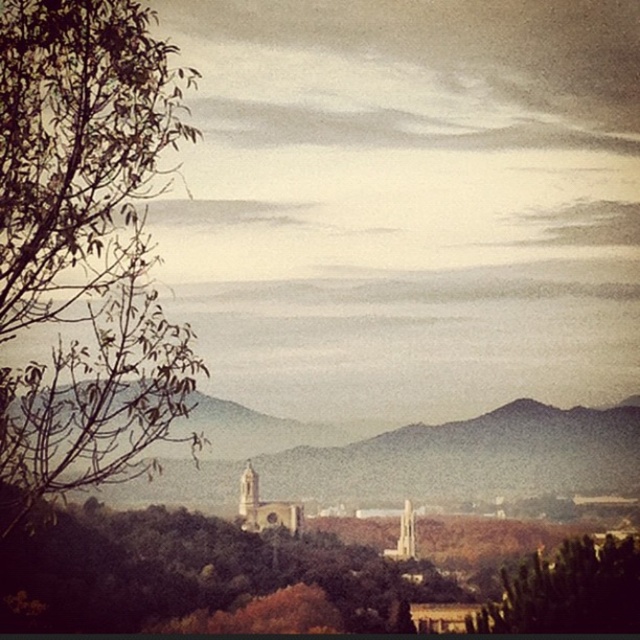
You are standing at point (84, 248) in the scene. Looking around, you see a green leafy tree at left. Is there any object in the scene that is closer to you than the green leafy tree at left?

The green leafy tree at left is located at point (84, 248), so you are standing right at its position. Therefore, there is no object closer to you than the green leafy tree at left since you are already at its location.

You are an architect planning to build a new observation deck in this area. Considering the green leafy tree at left and the brown stone church at center, which structure would provide a better vantage point for viewing the surrounding landscape?

The green leafy tree at left has a greater height compared to the brown stone church at center, so it would provide a better vantage point for viewing the surrounding landscape.

You are standing in the middle of the scene and see the green leafy tree at left and the green leafy tree at lower right. Which tree is positioned more to the left side of the scene?

The green leafy tree at left is positioned more to the left side of the scene than the green leafy tree at lower right.